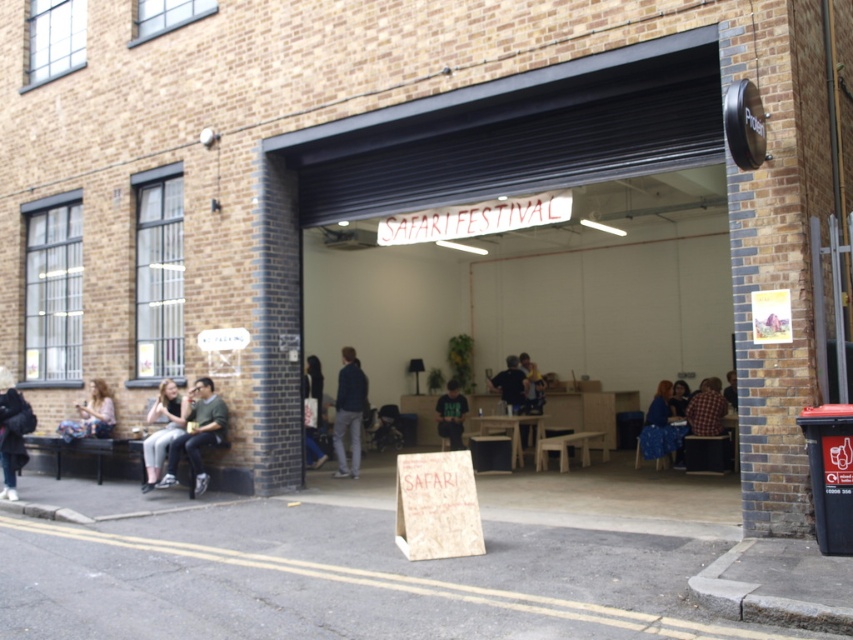
You are attending the Safari Festival and see two people wearing a light brown leather jacket at lower left and a green fabric shirt at center. Which person is sitting more to the left side?

The light brown leather jacket at lower left is more to the left side than the green fabric shirt at center.

You are standing in front of the brick building and want to take a photo of both the point at coordinates (189, 417) and the point at coordinates (663, 392). Which point should you focus on first to ensure both are in focus?

You should focus on the point at coordinates (189, 417) first because it is closer to the camera than the point at coordinates (663, 392). By focusing on the closer point, the farther point will also be within the depth of field, ensuring both are in focus.

From the picture: You are standing in front of the brick building and want to take a photo of both the point at coordinates [146,438] and the point at coordinates [437,403]. Which point should you focus on first to ensure both are in clear view?

You should focus on the point at coordinates [146,438] first because it is closer to you than the point at coordinates [437,403]. This ensures both points will be in clear view as the camera adjusts depth of field.